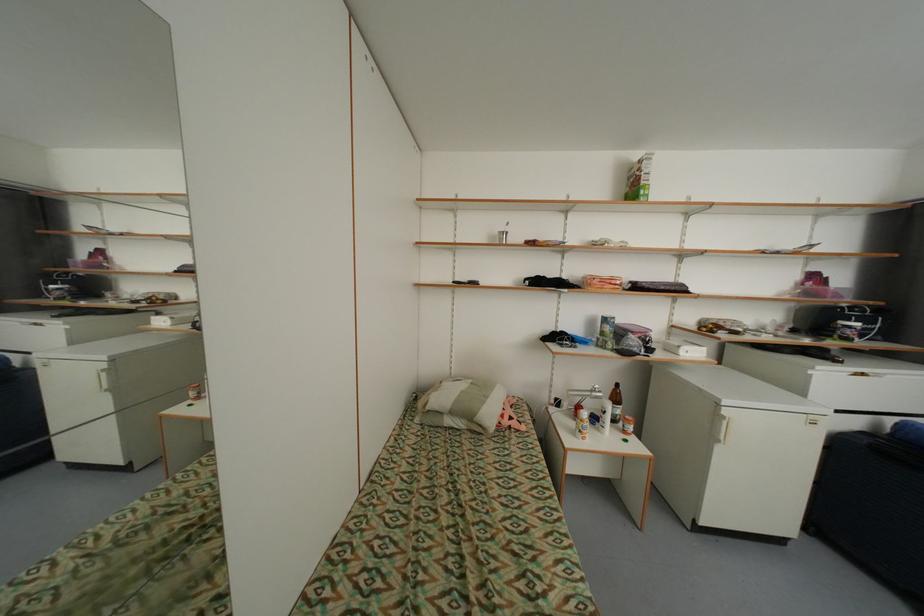
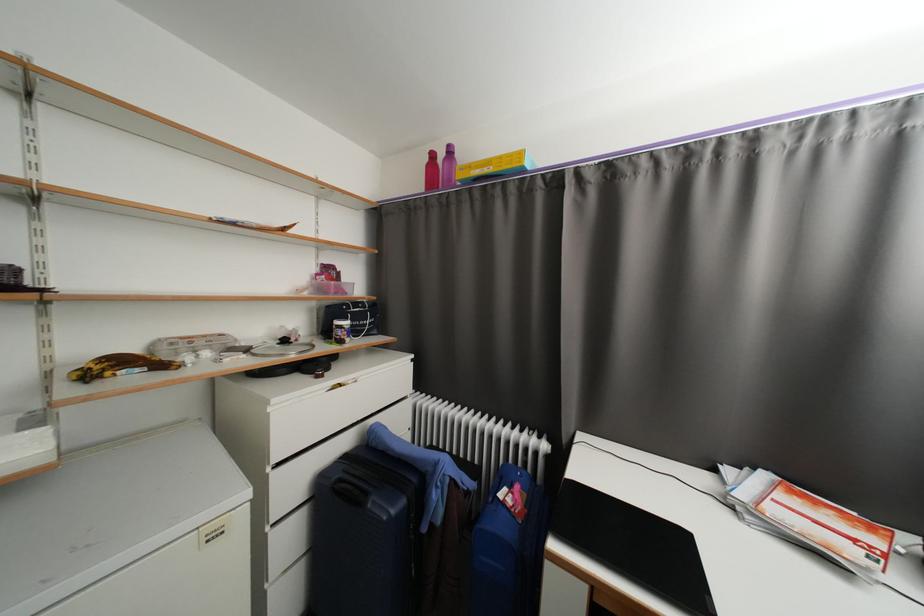
Where in the second image is the point corresponding to (864,326) from the first image?

(353, 323)